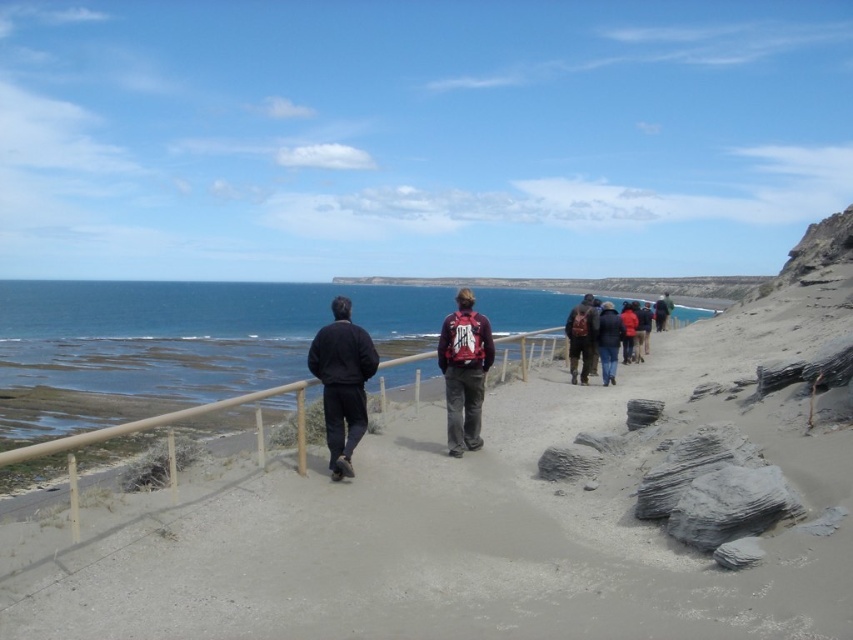
Based on the photo, can you confirm if matte brown backpack at center is thinner than dark blue jeans at center?

No.

Is matte brown backpack at center in front of dark blue jeans at center?

No, it is not.

Does point (566, 324) come behind point (602, 308)?

No, it is not.

Find the location of `matte brown backpack at center`. matte brown backpack at center is located at coordinates (581, 337).

Between dark blue jacket at center and matte red backpack at center, which one has more height?

Standing taller between the two is dark blue jacket at center.

Which is in front, point (334, 474) or point (476, 380)?

Point (334, 474)

I want to click on dark blue jacket at center, so click(x=341, y=381).

Who is higher up, dark blue jacket at center or matte brown backpack at center?

matte brown backpack at center

Is point (334, 448) farther from camera compared to point (590, 344)?

No, it is in front of (590, 344).

Which is behind, point (352, 410) or point (575, 344)?

The point (575, 344) is more distant.

I want to click on dark blue jacket at center, so click(341, 381).